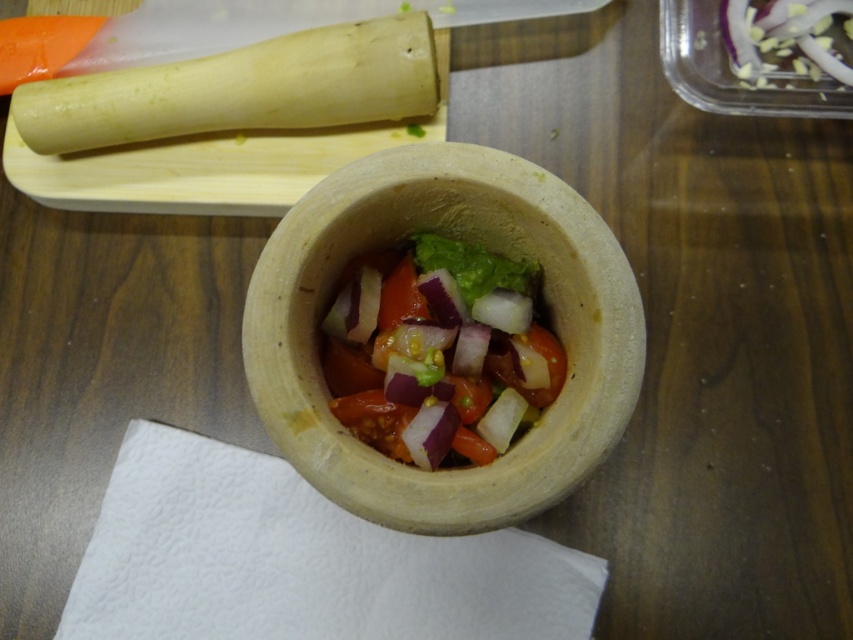
Is natural clay bowl at center thinner than green leafy lettuce at center?

No.

Is natural clay bowl at center behind green leafy lettuce at center?

No.

Locate an element on the screen. natural clay bowl at center is located at coordinates (454, 228).

Image resolution: width=853 pixels, height=640 pixels. What are the coordinates of `natural clay bowl at center` in the screenshot? It's located at (454, 228).

Does wooden cutting board at upper left lie in front of green leafy lettuce at center?

No, it is not.

Can you confirm if wooden cutting board at upper left is positioned below green leafy lettuce at center?

Incorrect, wooden cutting board at upper left is not positioned below green leafy lettuce at center.

The height and width of the screenshot is (640, 853). Find the location of `wooden cutting board at upper left`. wooden cutting board at upper left is located at coordinates (212, 164).

Where is `wooden cutting board at upper left`? Image resolution: width=853 pixels, height=640 pixels. wooden cutting board at upper left is located at coordinates (212, 164).

Is vibrant fresh salad at center below green leafy lettuce at center?

Correct, vibrant fresh salad at center is located below green leafy lettuce at center.

This screenshot has width=853, height=640. Describe the element at coordinates (439, 353) in the screenshot. I see `vibrant fresh salad at center` at that location.

The image size is (853, 640). What are the coordinates of `vibrant fresh salad at center` in the screenshot? It's located at click(x=439, y=353).